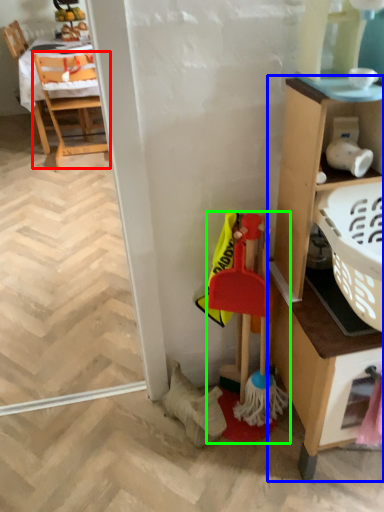
Question: Which is farther away from chair (highlighted by a red box)? cabinetry (highlighted by a blue box) or toy (highlighted by a green box)?

Choices:
 (A) cabinetry
 (B) toy

Answer: (A)